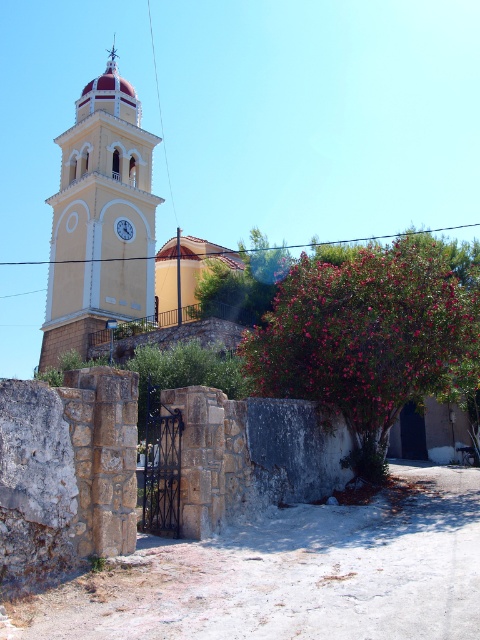
Does matte yellow clock tower at center have a smaller size compared to white glossy clock at upper center?

Incorrect, matte yellow clock tower at center is not smaller in size than white glossy clock at upper center.

In the scene shown: Who is positioned more to the left, matte yellow clock tower at center or white glossy clock at upper center?

Positioned to the left is matte yellow clock tower at center.

Between point (120, 147) and point (122, 236), which one is positioned behind?

Point (120, 147)

Locate an element on the screen. The width and height of the screenshot is (480, 640). matte yellow clock tower at center is located at coordinates (99, 218).